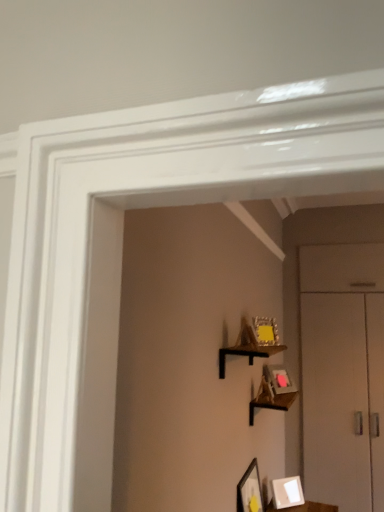
From the picture: In order to face white matte picture frame at lower center, marked as the 5th picture frame in a top-to-bottom arrangement, should I rotate leftwards or rightwards?

You should look right and rotate roughly 12.425 degrees.

Measure the distance between point (242, 340) and camera.

Point (242, 340) is 1.89 meters from camera.

Find the location of a particular element. This screenshot has width=384, height=512. wooden picture frame at center, the 1th picture frame when ordered from top to bottom is located at coordinates (245, 336).

Consider the image. Measure the distance between point (254, 406) and camera.

8.32 feet.

Image resolution: width=384 pixels, height=512 pixels. Describe the element at coordinates (253, 342) in the screenshot. I see `wooden shelf at upper center, which is the 1th shelf in top-to-bottom order` at that location.

You are a GUI agent. You are given a task and a screenshot of the screen. Output one action in this format:
    pyautogui.click(x=<x>, y=<y>)
    Task: Click on the white matte picture frame at lower center, which is the first picture frame in bottom-to-top order
    This screenshot has height=512, width=384.
    Given the screenshot: What is the action you would take?
    pyautogui.click(x=287, y=492)

Between wooden picture frame at center, the 5th picture frame ordered from the bottom, and matte gold picture frame at upper center, arranged as the 2th picture frame when viewed from the top, which one is positioned behind?

matte gold picture frame at upper center, arranged as the 2th picture frame when viewed from the top.

Which is behind, point (256, 345) or point (262, 320)?

The point (262, 320) is farther.

From a real-world perspective, which object stands above the other?

matte gold picture frame at upper center, the 4th picture frame when ordered from bottom to top.

Does wooden picture frame at center, the 5th picture frame ordered from the bottom, touch matte gold picture frame at upper center, arranged as the 2th picture frame when viewed from the top?

Yes, wooden picture frame at center, the 5th picture frame ordered from the bottom, is with matte gold picture frame at upper center, arranged as the 2th picture frame when viewed from the top.

Is point (248, 338) positioned after point (253, 326)?

No.

From a real-world perspective, who is located lower, wooden shelf at upper center, which is the second shelf from bottom to top, or matte gold picture frame at upper center, the 4th picture frame when ordered from bottom to top?

From a 3D spatial view, wooden shelf at upper center, which is the second shelf from bottom to top, is below.

Based on their positions, is wooden shelf at upper center, the 1th shelf positioned from the front, located to the left or right of matte gold picture frame at upper center, the 4th picture frame when ordered from bottom to top?

wooden shelf at upper center, the 1th shelf positioned from the front, is positioned on matte gold picture frame at upper center, the 4th picture frame when ordered from bottom to top,'s left side.

Is wooden shelf at upper center, which is the 1th shelf in top-to-bottom order, in front of or behind wooden shelf at center, which is the 1th shelf from bottom to top, in the image?

wooden shelf at upper center, which is the 1th shelf in top-to-bottom order, is positioned closer to the viewer than wooden shelf at center, which is the 1th shelf from bottom to top.

Is wooden shelf at upper center, which is the 1th shelf in top-to-bottom order, to the left or to the right of wooden shelf at center, which is the 1th shelf in back-to-front order, in the image?

Clearly, wooden shelf at upper center, which is the 1th shelf in top-to-bottom order, is on the left of wooden shelf at center, which is the 1th shelf in back-to-front order, in the image.

Can you confirm if wooden shelf at upper center, which is the 2th shelf in back-to-front order, is smaller than wooden shelf at center, which is the 2th shelf in front-to-back order?

Correct, wooden shelf at upper center, which is the 2th shelf in back-to-front order, occupies less space than wooden shelf at center, which is the 2th shelf in front-to-back order.

From a real-world perspective, is wooden shelf at upper center, which is the 2th shelf in back-to-front order, physically below wooden shelf at center, which is the 2th shelf in front-to-back order?

Incorrect, from a real-world perspective, wooden shelf at upper center, which is the 2th shelf in back-to-front order, is higher than wooden shelf at center, which is the 2th shelf in front-to-back order.

Measure the distance from white matte picture frame at lower center, which is the first picture frame in bottom-to-top order, to wooden picture frame at center, the 1th picture frame when ordered from top to bottom.

1.25 meters.

Between white matte picture frame at lower center, which is the first picture frame in bottom-to-top order, and wooden picture frame at center, the 1th picture frame when ordered from top to bottom, which one appears on the left side from the viewer's perspective?

wooden picture frame at center, the 1th picture frame when ordered from top to bottom, is more to the left.

Is white matte picture frame at lower center, which is the first picture frame in bottom-to-top order, situated inside wooden picture frame at center, the 1th picture frame when ordered from top to bottom, or outside?

white matte picture frame at lower center, which is the first picture frame in bottom-to-top order, is located beyond the bounds of wooden picture frame at center, the 1th picture frame when ordered from top to bottom.

Which of these two, white matte picture frame at lower center, marked as the 5th picture frame in a top-to-bottom arrangement, or wooden picture frame at center, the 5th picture frame ordered from the bottom, stands taller?

With more height is white matte picture frame at lower center, marked as the 5th picture frame in a top-to-bottom arrangement.

Who is shorter, white matte picture frame at lower center, marked as the 5th picture frame in a top-to-bottom arrangement, or matte gold picture frame at upper center, arranged as the 2th picture frame when viewed from the top?

With less height is white matte picture frame at lower center, marked as the 5th picture frame in a top-to-bottom arrangement.

From the image's perspective, would you say white matte picture frame at lower center, which is the first picture frame in bottom-to-top order, is shown under matte gold picture frame at upper center, arranged as the 2th picture frame when viewed from the top?

Yes, from the image's perspective, white matte picture frame at lower center, which is the first picture frame in bottom-to-top order, is below matte gold picture frame at upper center, arranged as the 2th picture frame when viewed from the top.

Based on the photo, between white matte picture frame at lower center, marked as the 5th picture frame in a top-to-bottom arrangement, and matte gold picture frame at upper center, arranged as the 2th picture frame when viewed from the top, which one has larger size?

white matte picture frame at lower center, marked as the 5th picture frame in a top-to-bottom arrangement, is bigger.

Considering the relative positions of white matte picture frame at lower center, marked as the 5th picture frame in a top-to-bottom arrangement, and matte gold picture frame at upper center, arranged as the 2th picture frame when viewed from the top, in the image provided, is white matte picture frame at lower center, marked as the 5th picture frame in a top-to-bottom arrangement, to the left or to the right of matte gold picture frame at upper center, arranged as the 2th picture frame when viewed from the top,?

Clearly, white matte picture frame at lower center, marked as the 5th picture frame in a top-to-bottom arrangement, is on the right of matte gold picture frame at upper center, arranged as the 2th picture frame when viewed from the top, in the image.

In terms of size, does white matte picture frame at lower center, marked as the 5th picture frame in a top-to-bottom arrangement, appear bigger or smaller than wooden shelf at center, which is the 1th shelf from bottom to top?

In the image, white matte picture frame at lower center, marked as the 5th picture frame in a top-to-bottom arrangement, appears to be smaller than wooden shelf at center, which is the 1th shelf from bottom to top.

Is white matte picture frame at lower center, which is the first picture frame in bottom-to-top order, closer to camera compared to wooden shelf at center, which is the 1th shelf from bottom to top?

No, white matte picture frame at lower center, which is the first picture frame in bottom-to-top order, is behind wooden shelf at center, which is the 1th shelf from bottom to top.

Looking at this image, from the image's perspective, between white matte picture frame at lower center, marked as the 5th picture frame in a top-to-bottom arrangement, and wooden shelf at center, which is the 2th shelf in front-to-back order, which one is located above?

wooden shelf at center, which is the 2th shelf in front-to-back order, is shown above in the image.

Between white matte picture frame at lower center, marked as the 5th picture frame in a top-to-bottom arrangement, and wooden shelf at center, which is the 1th shelf from bottom to top, which one has smaller width?

Thinner between the two is white matte picture frame at lower center, marked as the 5th picture frame in a top-to-bottom arrangement.

From the image's perspective, is matte black picture frame at lower center, placed as the 4th picture frame when sorted from top to bottom, under matte gold picture frame at upper center, arranged as the 2th picture frame when viewed from the top?

Yes, from the image's perspective, matte black picture frame at lower center, placed as the 4th picture frame when sorted from top to bottom, is below matte gold picture frame at upper center, arranged as the 2th picture frame when viewed from the top.

Who is bigger, matte black picture frame at lower center, the 2th picture frame from the bottom, or matte gold picture frame at upper center, the 4th picture frame when ordered from bottom to top?

matte black picture frame at lower center, the 2th picture frame from the bottom, is bigger.

How many degrees apart are the facing directions of matte black picture frame at lower center, placed as the 4th picture frame when sorted from top to bottom, and matte gold picture frame at upper center, arranged as the 2th picture frame when viewed from the top?

The angular difference between matte black picture frame at lower center, placed as the 4th picture frame when sorted from top to bottom, and matte gold picture frame at upper center, arranged as the 2th picture frame when viewed from the top, is 28.4 degrees.

Does matte black picture frame at lower center, placed as the 4th picture frame when sorted from top to bottom, touch matte gold picture frame at upper center, the 4th picture frame when ordered from bottom to top?

matte black picture frame at lower center, placed as the 4th picture frame when sorted from top to bottom, and matte gold picture frame at upper center, the 4th picture frame when ordered from bottom to top, are not in contact.

Find the location of a particular element. This screenshot has height=512, width=384. picture frame that is the 1st one when counting downward from the wooden picture frame at center, the 5th picture frame ordered from the bottom (from the image's perspective) is located at coordinates (265, 331).

At what (x,y) coordinates should I click in order to perform the action: click on shelf on the left of matte gold picture frame at upper center, arranged as the 2th picture frame when viewed from the top. Please return your answer as a coordinate pair (x, y). The width and height of the screenshot is (384, 512). Looking at the image, I should click on (x=253, y=342).

Estimate the real-world distances between objects in this image. Which object is closer to matte black picture frame at lower center, the 2th picture frame from the bottom, matte gold picture frame at upper right, which is the third picture frame from top to bottom, or wooden picture frame at center, the 5th picture frame ordered from the bottom?

matte gold picture frame at upper right, which is the third picture frame from top to bottom.

Considering their positions, is wooden picture frame at center, the 5th picture frame ordered from the bottom, positioned further to matte gold picture frame at upper center, the 4th picture frame when ordered from bottom to top, than matte black picture frame at lower center, the 2th picture frame from the bottom?

The object further to matte gold picture frame at upper center, the 4th picture frame when ordered from bottom to top, is matte black picture frame at lower center, the 2th picture frame from the bottom.

From the image, which object appears to be nearer to wooden shelf at upper center, which is the second shelf from bottom to top, wooden picture frame at center, the 5th picture frame ordered from the bottom, or matte gold picture frame at upper center, arranged as the 2th picture frame when viewed from the top?

wooden picture frame at center, the 5th picture frame ordered from the bottom, lies closer to wooden shelf at upper center, which is the second shelf from bottom to top, than the other object.

Based on their spatial positions, is wooden shelf at center, which is counted as the 2th shelf, starting from the top, or wooden picture frame at center, the 1th picture frame when ordered from top to bottom, further from wooden shelf at upper center, which is the 1th shelf in top-to-bottom order?

wooden shelf at center, which is counted as the 2th shelf, starting from the top, is positioned further to the anchor wooden shelf at upper center, which is the 1th shelf in top-to-bottom order.

Estimate the real-world distances between objects in this image. Which object is further from wooden picture frame at center, the 5th picture frame ordered from the bottom, matte black picture frame at lower center, the 2th picture frame from the bottom, or white matte picture frame at lower center, marked as the 5th picture frame in a top-to-bottom arrangement?

white matte picture frame at lower center, marked as the 5th picture frame in a top-to-bottom arrangement, is further to wooden picture frame at center, the 5th picture frame ordered from the bottom.

Looking at the image, which one is located closer to matte gold picture frame at upper center, the 4th picture frame when ordered from bottom to top, wooden shelf at center, which is the 2th shelf in front-to-back order, or wooden shelf at upper center, which is the second shelf from bottom to top?

wooden shelf at upper center, which is the second shelf from bottom to top.

Looking at the image, which one is located closer to white matte picture frame at lower center, marked as the 5th picture frame in a top-to-bottom arrangement, matte gold picture frame at upper right, which is the third picture frame from top to bottom, or matte gold picture frame at upper center, the 4th picture frame when ordered from bottom to top?

matte gold picture frame at upper right, which is the third picture frame from top to bottom, is closer to white matte picture frame at lower center, marked as the 5th picture frame in a top-to-bottom arrangement.

Looking at the image, which one is located further to white matte picture frame at lower center, which is the first picture frame in bottom-to-top order, wooden shelf at center, which is the 1th shelf from bottom to top, or matte gold picture frame at upper right, which is the third picture frame from top to bottom?

The object further to white matte picture frame at lower center, which is the first picture frame in bottom-to-top order, is matte gold picture frame at upper right, which is the third picture frame from top to bottom.

Locate an element on the screen. The image size is (384, 512). picture frame between matte gold picture frame at upper center, arranged as the 2th picture frame when viewed from the top, and matte black picture frame at lower center, placed as the 4th picture frame when sorted from top to bottom, from top to bottom is located at coordinates click(x=279, y=379).

I want to click on shelf positioned between matte black picture frame at lower center, placed as the 4th picture frame when sorted from top to bottom, and white matte picture frame at lower center, which is the first picture frame in bottom-to-top order, from near to far, so click(x=272, y=392).

Identify the location of shelf between matte gold picture frame at upper right, which is the third picture frame from top to bottom, and white matte picture frame at lower center, which is the first picture frame in bottom-to-top order, from top to bottom. The width and height of the screenshot is (384, 512). (272, 392).

Where is `shelf positioned between matte black picture frame at lower center, placed as the 4th picture frame when sorted from top to bottom, and matte gold picture frame at upper right, which is the third picture frame from top to bottom, from near to far`? The image size is (384, 512). shelf positioned between matte black picture frame at lower center, placed as the 4th picture frame when sorted from top to bottom, and matte gold picture frame at upper right, which is the third picture frame from top to bottom, from near to far is located at coordinates 272,392.